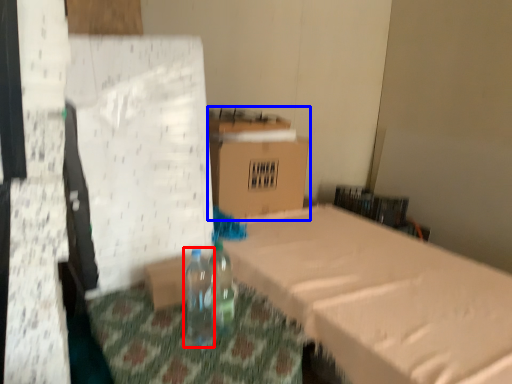
Question: Which of the following is the closest to the observer, bottle (highlighted by a red box) or cardboard box (highlighted by a blue box)?

Choices:
 (A) bottle
 (B) cardboard box

Answer: (A)